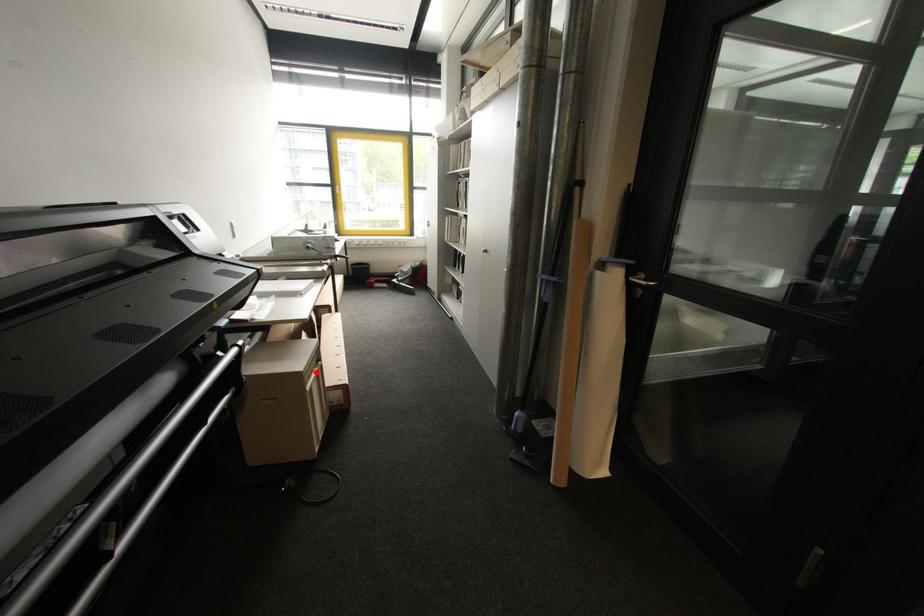
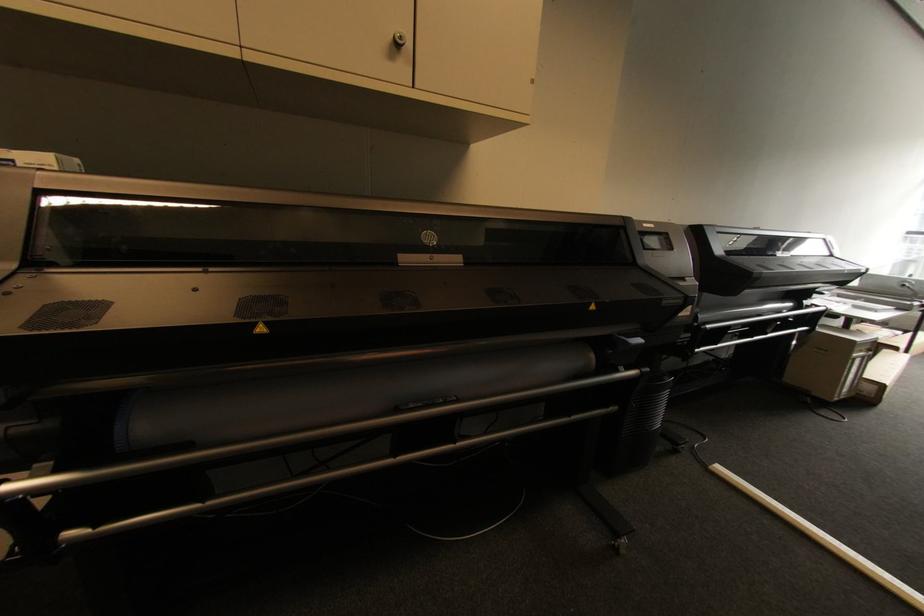
Question: I am providing you with two images of the same scene from different viewpoints. Given a red point in image1, look at the same physical point in image2. Is it:

Choices:
 (A) Closer to the viewpoint
 (B) Farther from the viewpoint

Answer: (A)